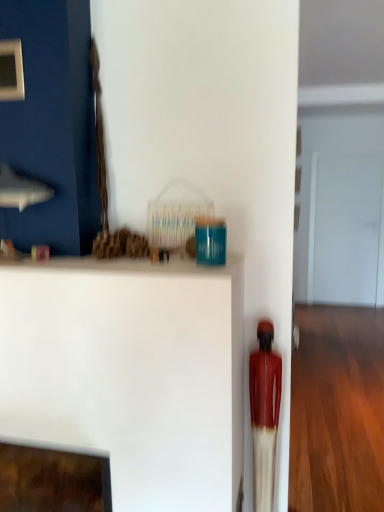
Question: Does matte red statue at right appear on the right side of transparent glass door at center?

Choices:
 (A) no
 (B) yes

Answer: (A)

Question: Considering the relative sizes of matte red statue at right and transparent glass door at center in the image provided, is matte red statue at right thinner than transparent glass door at center?

Choices:
 (A) yes
 (B) no

Answer: (B)

Question: Is matte red statue at right positioned with its back to transparent glass door at center?

Choices:
 (A) no
 (B) yes

Answer: (A)

Question: Is matte red statue at right oriented towards transparent glass door at center?

Choices:
 (A) yes
 (B) no

Answer: (B)

Question: Is matte red statue at right further to the viewer compared to transparent glass door at center?

Choices:
 (A) no
 (B) yes

Answer: (A)

Question: From a real-world perspective, is white matte shelf at center above or below transparent glass door at center?

Choices:
 (A) above
 (B) below

Answer: (B)

Question: Relative to transparent glass door at center, is white matte shelf at center in front or behind?

Choices:
 (A) behind
 (B) front

Answer: (B)

Question: In terms of size, does white matte shelf at center appear bigger or smaller than transparent glass door at center?

Choices:
 (A) big
 (B) small

Answer: (A)

Question: Considering the positions of white matte shelf at center and transparent glass door at center in the image, is white matte shelf at center wider or thinner than transparent glass door at center?

Choices:
 (A) wide
 (B) thin

Answer: (A)

Question: Would you say transparent glass door at center is to the left or to the right of matte red statue at right in the picture?

Choices:
 (A) left
 (B) right

Answer: (B)

Question: Considering the positions of transparent glass door at center and matte red statue at right in the image, is transparent glass door at center taller or shorter than matte red statue at right?

Choices:
 (A) short
 (B) tall

Answer: (B)

Question: Does point (331, 266) appear closer or farther from the camera than point (271, 356)?

Choices:
 (A) farther
 (B) closer

Answer: (A)

Question: Choose the correct answer: Is transparent glass door at center inside matte red statue at right or outside it?

Choices:
 (A) outside
 (B) inside

Answer: (A)

Question: From the image's perspective, relative to matte red statue at right, is white matte shelf at center above or below?

Choices:
 (A) above
 (B) below

Answer: (B)

Question: Is white matte shelf at center taller or shorter than matte red statue at right?

Choices:
 (A) tall
 (B) short

Answer: (A)